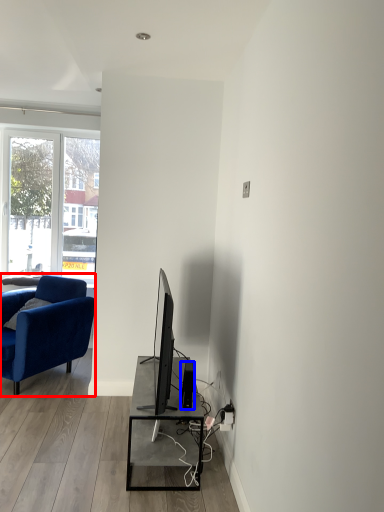
Question: Which of the following is the farthest to the observer, chair (highlighted by a red box) or speaker (highlighted by a blue box)?

Choices:
 (A) chair
 (B) speaker

Answer: (A)